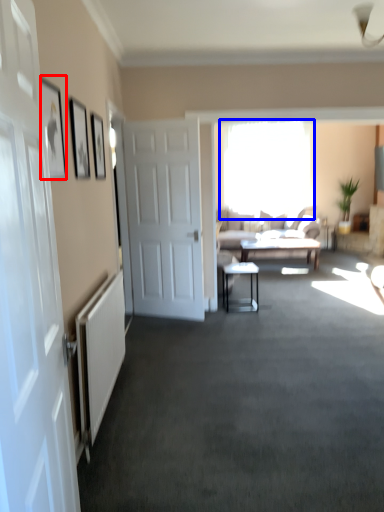
Question: Which of the following is the closest to the observer, picture frame (highlighted by a red box) or window (highlighted by a blue box)?

Choices:
 (A) picture frame
 (B) window

Answer: (A)